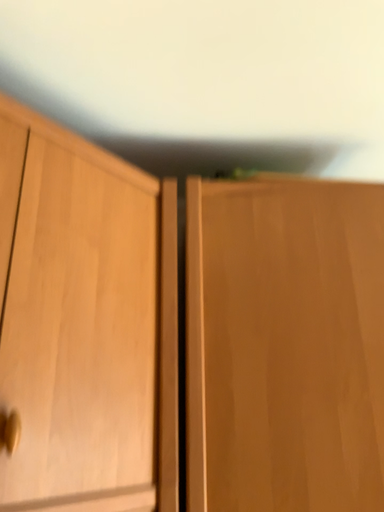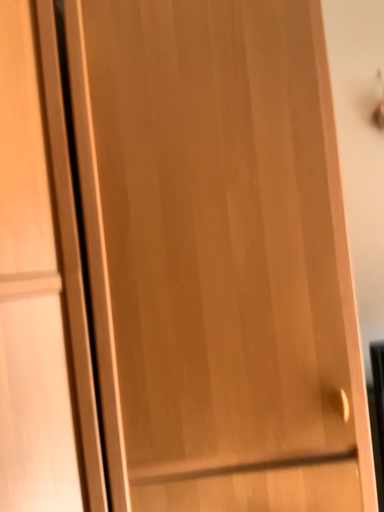
Question: Which way did the camera rotate in the video?

Choices:
 (A) rotated upward
 (B) rotated downward

Answer: (B)